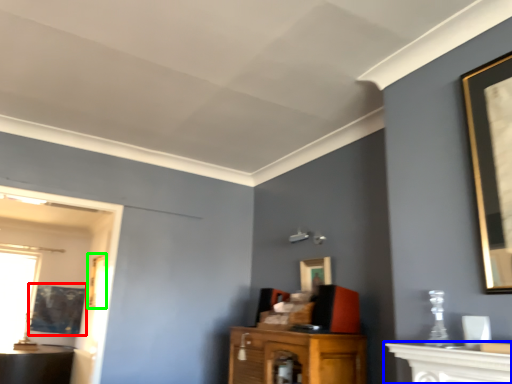
Question: Based on their relative distances, which object is farther from picture frame (highlighted by a red box)? Choose from vanity (highlighted by a blue box) and picture frame (highlighted by a green box).

Choices:
 (A) vanity
 (B) picture frame

Answer: (A)